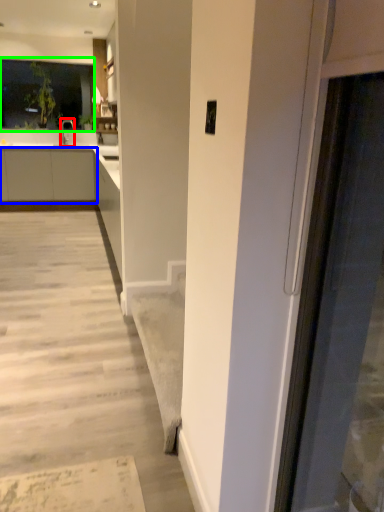
Question: Which is nearer to the tap (highlighted by a red box)? cabinetry (highlighted by a blue box) or window (highlighted by a green box).

Choices:
 (A) cabinetry
 (B) window

Answer: (B)